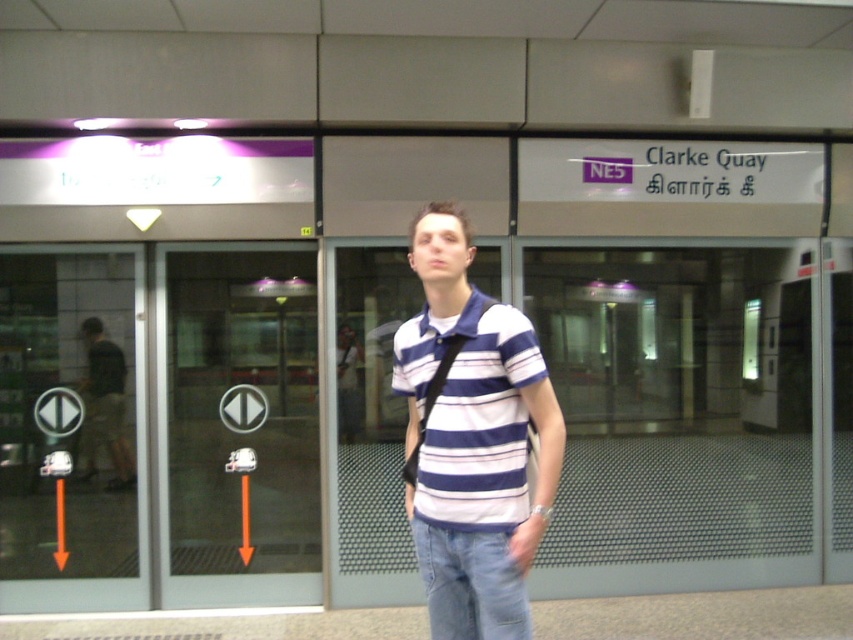
Question: Among these objects, which one is farthest from the camera?

Choices:
 (A) transparent glass door at left
 (B) striped cotton shirt at center

Answer: (A)

Question: Among these objects, which one is farthest from the camera?

Choices:
 (A) transparent glass door at left
 (B) striped cotton shirt at center

Answer: (A)

Question: In this image, where is transparent glass door at left located relative to striped cotton shirt at center?

Choices:
 (A) right
 (B) left

Answer: (B)

Question: Which object appears closest to the camera in this image?

Choices:
 (A) striped cotton shirt at center
 (B) transparent glass door at left

Answer: (A)

Question: Is striped cotton shirt at center smaller than dark gray shirt at left?

Choices:
 (A) yes
 (B) no

Answer: (B)

Question: Does striped cotton shirt at center have a smaller size compared to dark gray shirt at left?

Choices:
 (A) no
 (B) yes

Answer: (A)